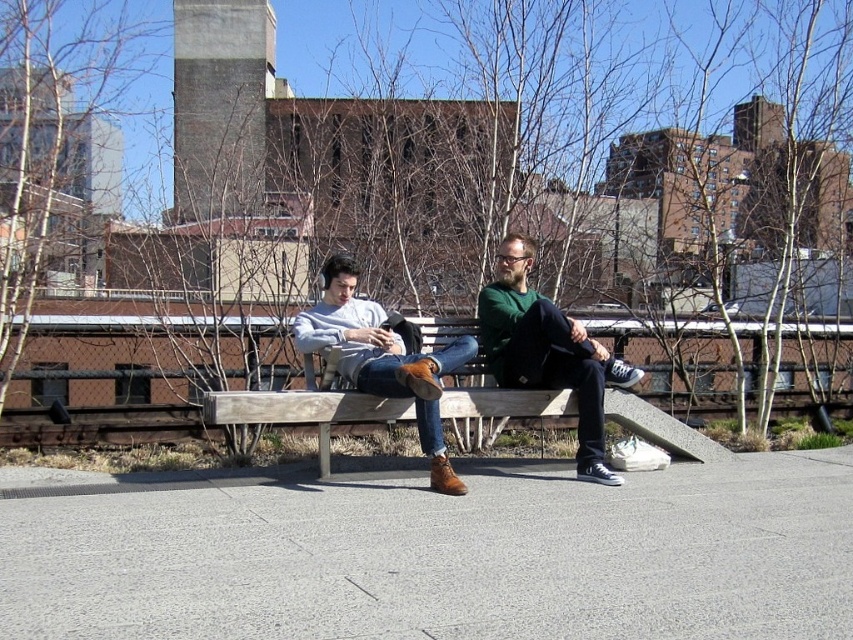
Between point (328, 296) and point (482, 317), which one is positioned in front?

Point (328, 296) is more forward.

Who is more distant from viewer, (579, 468) or (566, 344)?

The point (579, 468) is more distant.

This screenshot has width=853, height=640. Find the location of `matte brown leather shoes at center`. matte brown leather shoes at center is located at coordinates (547, 352).

Is point (537, 374) positioned behind point (399, 376)?

Yes, it is behind point (399, 376).

Image resolution: width=853 pixels, height=640 pixels. Find the location of `matte brown leather shoes at center`. matte brown leather shoes at center is located at coordinates (547, 352).

Can you confirm if green sweater at center is taller than matte leather shoes at center?

Correct, green sweater at center is much taller as matte leather shoes at center.

Is green sweater at center bigger than matte leather shoes at center?

No.

Describe the element at coordinates (547, 352) in the screenshot. This screenshot has width=853, height=640. I see `green sweater at center` at that location.

At what (x,y) coordinates should I click in order to perform the action: click on green sweater at center. Please return your answer as a coordinate pair (x, y). This screenshot has height=640, width=853. Looking at the image, I should click on (547, 352).